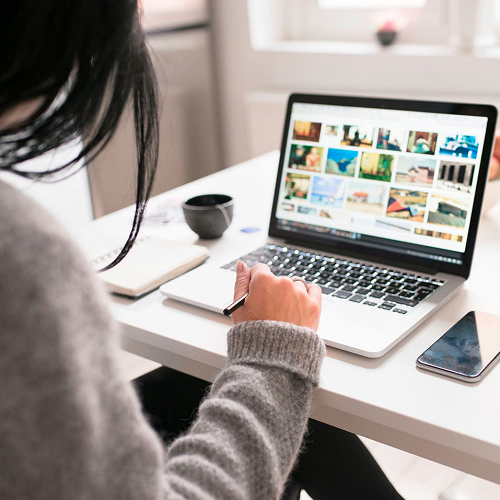
This screenshot has height=500, width=500. I want to click on pen, so click(235, 312).